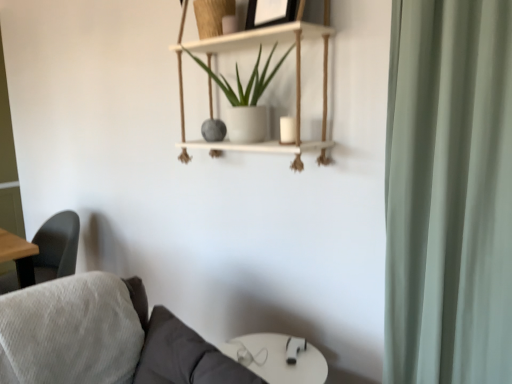
Question: Is textured gray fabric couch at lower left situated inside white wood shelf at upper center or outside?

Choices:
 (A) outside
 (B) inside

Answer: (A)

Question: Is textured gray fabric couch at lower left wider or thinner than white wood shelf at upper center?

Choices:
 (A) wide
 (B) thin

Answer: (A)

Question: Estimate the real-world distances between objects in this image. Which object is closer to the wooden picture frame at upper center?

Choices:
 (A) white wood shelf at upper center
 (B) white glossy round table at lower center
 (C) white matte pot at upper center
 (D) textured gray fabric couch at lower left

Answer: (C)

Question: Estimate the real-world distances between objects in this image. Which object is closer to the white wood shelf at upper center?

Choices:
 (A) white matte pot at upper center
 (B) wooden picture frame at upper center
 (C) textured gray fabric couch at lower left
 (D) white glossy round table at lower center

Answer: (A)